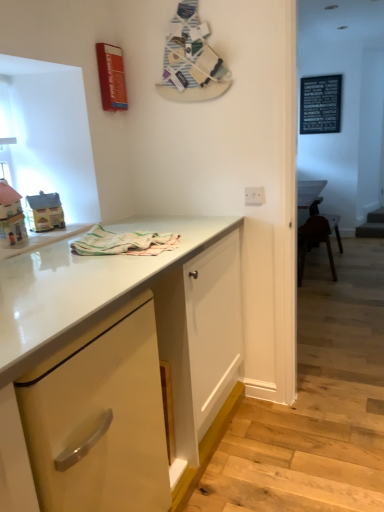
Where is `vacant area in front of matte yellow house at left, the first toy from the back`? This screenshot has width=384, height=512. vacant area in front of matte yellow house at left, the first toy from the back is located at coordinates (42, 239).